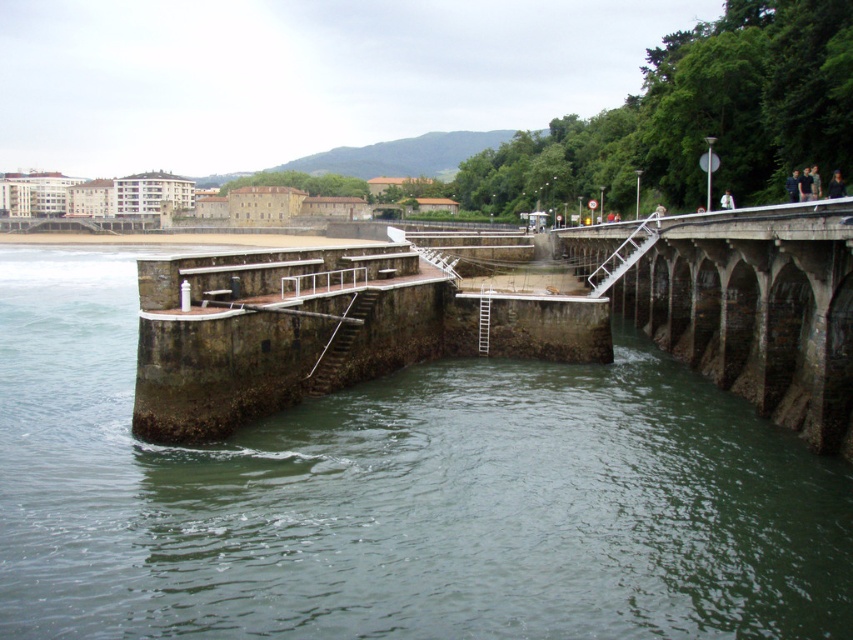
Does point (666, 317) come behind point (795, 195)?

That is True.

Who is shorter, stone bridge at center or dark blue fabric jacket at upper right?

With less height is dark blue fabric jacket at upper right.

The width and height of the screenshot is (853, 640). In order to click on stone bridge at center in this screenshot , I will do `click(509, 316)`.

Is green stone river at center above dark blue fabric jacket at upper right?

No, green stone river at center is not above dark blue fabric jacket at upper right.

In the scene shown: Can you confirm if green stone river at center is shorter than dark blue fabric jacket at upper right?

Incorrect, green stone river at center's height does not fall short of dark blue fabric jacket at upper right's.

Does point (704, 598) come closer to viewer compared to point (795, 189)?

Yes, it is.

At what (x,y) coordinates should I click in order to perform the action: click on green stone river at center. Please return your answer as a coordinate pair (x, y). The height and width of the screenshot is (640, 853). Looking at the image, I should click on [x=398, y=496].

Does rusty metal stairs at center appear over white metal stairs at center?

Actually, rusty metal stairs at center is below white metal stairs at center.

Does point (303, 380) lie in front of point (613, 259)?

Yes, point (303, 380) is in front of point (613, 259).

Is point (349, 342) farther from viewer compared to point (631, 264)?

No.

At what (x,y) coordinates should I click in order to perform the action: click on rusty metal stairs at center. Please return your answer as a coordinate pair (x, y). Image resolution: width=853 pixels, height=640 pixels. Looking at the image, I should click on (339, 342).